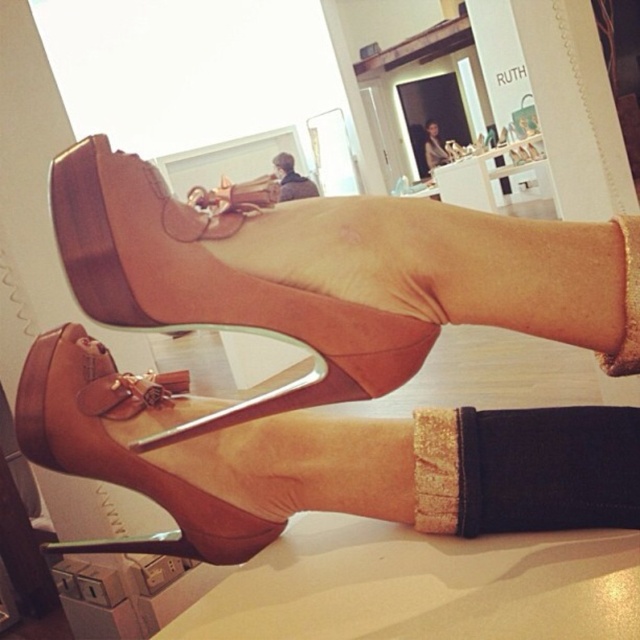
Question: Among these points, which one is farthest from the camera?

Choices:
 (A) (420, 340)
 (B) (134, 484)

Answer: (B)

Question: Which object appears farthest from the camera in this image?

Choices:
 (A) brown leather shoe at center
 (B) suede high-heeled shoe at center

Answer: (A)

Question: Is suede brown sandal at center wider than matte brown shoe at upper center?

Choices:
 (A) no
 (B) yes

Answer: (A)

Question: Is suede high-heeled shoe at center positioned at the back of matte brown shoe at upper center?

Choices:
 (A) no
 (B) yes

Answer: (A)

Question: Where is suede high-heeled shoe at center located in relation to suede brown sandal at center in the image?

Choices:
 (A) right
 (B) left

Answer: (A)

Question: Estimate the real-world distances between objects in this image. Which object is farther from the suede brown sandal at center?

Choices:
 (A) brown leather shoe at center
 (B) suede high-heeled shoe at center
 (C) matte brown shoe at upper center

Answer: (C)